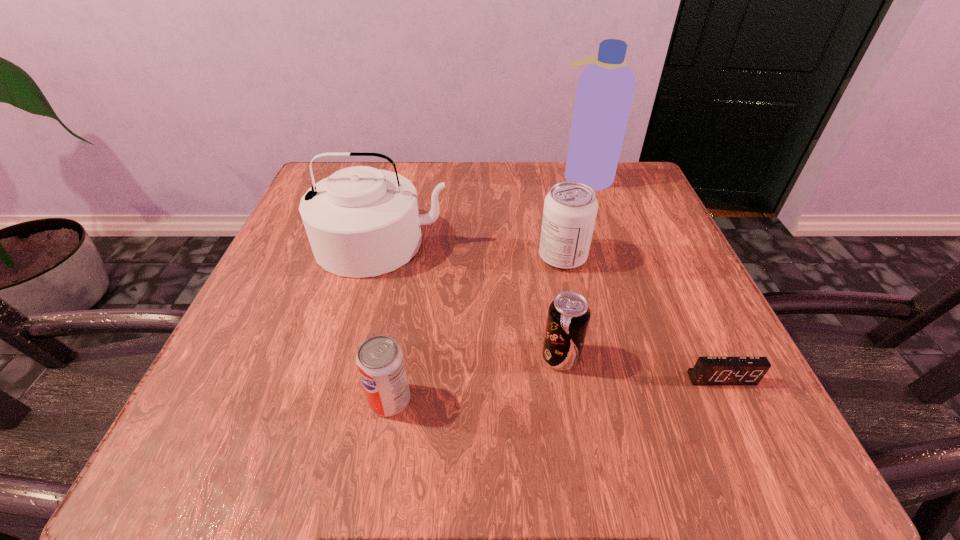
Where is `the tallest object`? the tallest object is located at coordinates (605, 89).

Where is `shampoo`? shampoo is located at coordinates (605, 89).

This screenshot has height=540, width=960. In order to click on the fifth shortest object in this screenshot , I will do `click(361, 221)`.

Where is `the farthest soda`? The image size is (960, 540). the farthest soda is located at coordinates (570, 208).

Identify the location of the tallest soda. The height and width of the screenshot is (540, 960). (570, 208).

Locate an element on the screen. the second farthest soda is located at coordinates (568, 318).

The image size is (960, 540). What are the coordinates of `the leftmost soda` in the screenshot? It's located at (380, 362).

Image resolution: width=960 pixels, height=540 pixels. I want to click on alarm clock, so click(x=708, y=370).

The width and height of the screenshot is (960, 540). I want to click on vacant position located on the left of the tallest object, so click(x=502, y=177).

I want to click on free region located on the spout of the fifth shortest object, so click(368, 299).